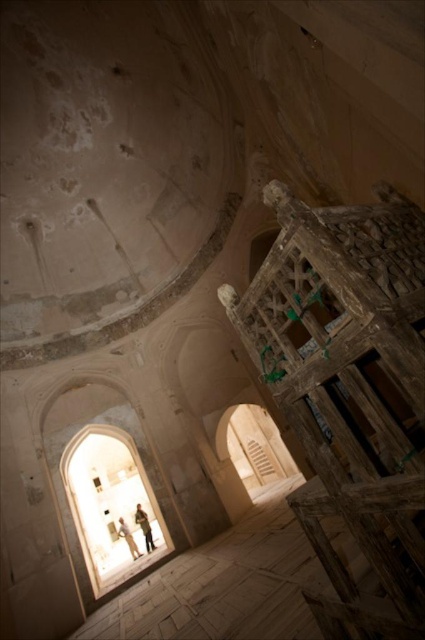
Does light brown leather jacket at lower center have a greater width compared to light beige fabric person at lower center?

In fact, light brown leather jacket at lower center might be narrower than light beige fabric person at lower center.

Between light brown leather jacket at lower center and light beige fabric person at lower center, which one appears on the right side from the viewer's perspective?

light brown leather jacket at lower center is more to the right.

Who is more distant from viewer, (146, 540) or (136, 547)?

The point (136, 547) is more distant.

What are the coordinates of `light brown leather jacket at lower center` in the screenshot? It's located at (144, 525).